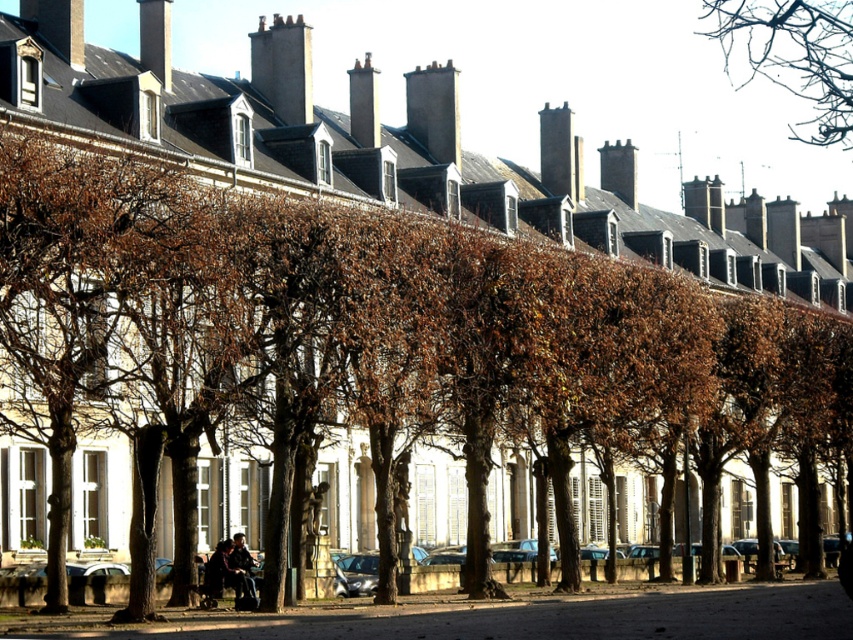
Question: Which point is closer to the camera?

Choices:
 (A) brown leafless branches at upper right
 (B) dark blue jeans at lower center

Answer: (B)

Question: Can you confirm if brown leafless branches at upper right is positioned to the right of dark blue jeans at lower center?

Choices:
 (A) no
 (B) yes

Answer: (B)

Question: Can you confirm if brown leafless branches at upper right is bigger than dark blue jeans at lower center?

Choices:
 (A) no
 (B) yes

Answer: (B)

Question: Can you confirm if brown leafless branches at upper right is positioned to the right of dark blue jeans at lower center?

Choices:
 (A) yes
 (B) no

Answer: (A)